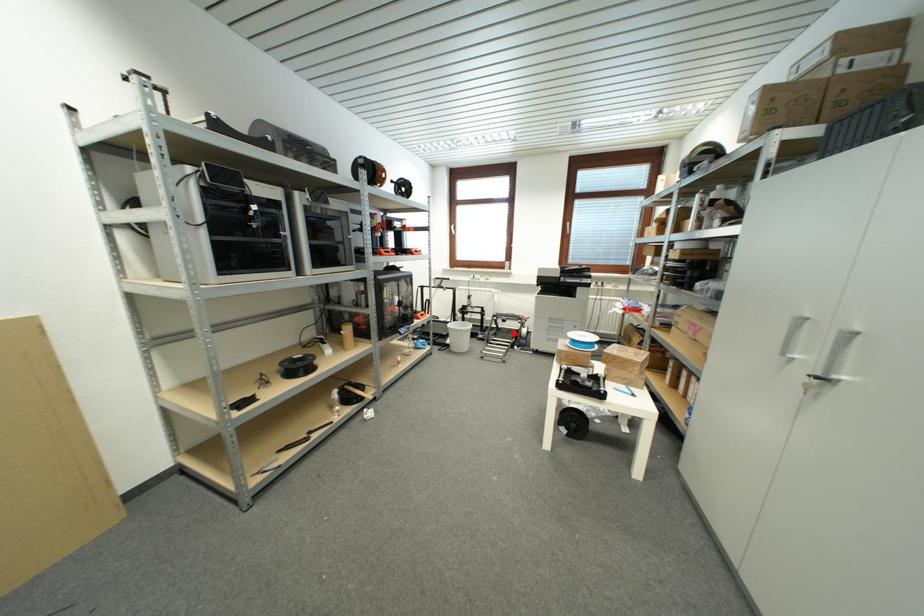
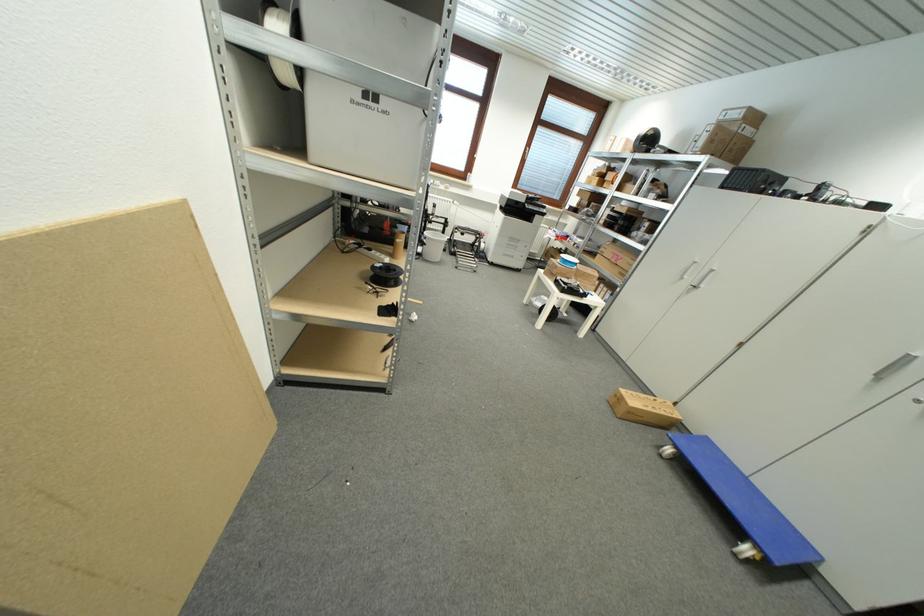
In the second image, find the point that corresponds to the highlighted location in the first image.

(468, 246)